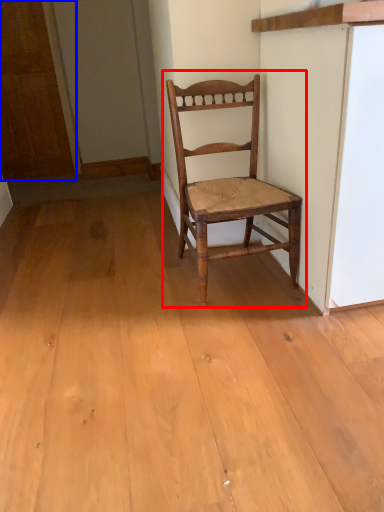
Question: Which object is further to the camera taking this photo, chair (highlighted by a red box) or door (highlighted by a blue box)?

Choices:
 (A) chair
 (B) door

Answer: (B)